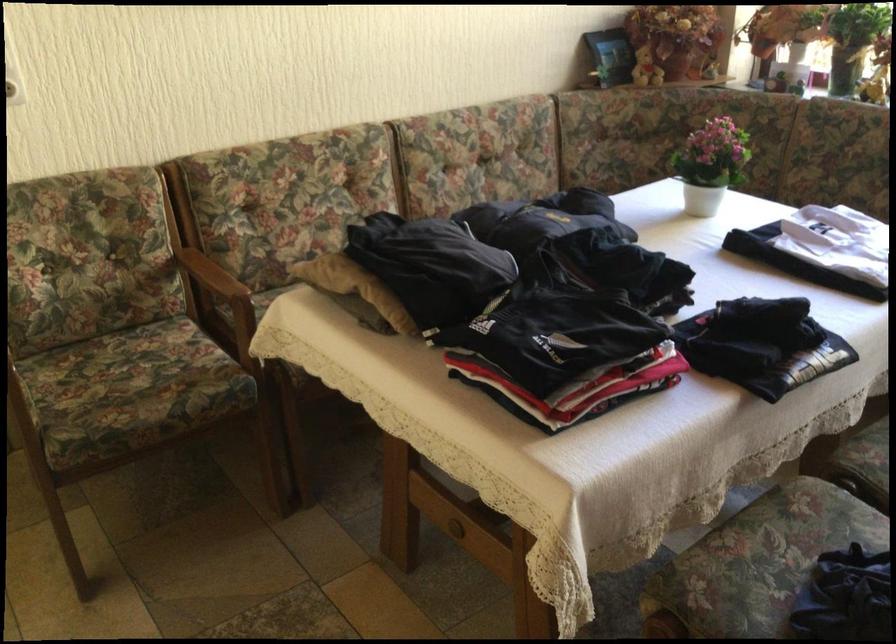
Find the location of a particular element. wooden chair armrest is located at coordinates (204, 269).